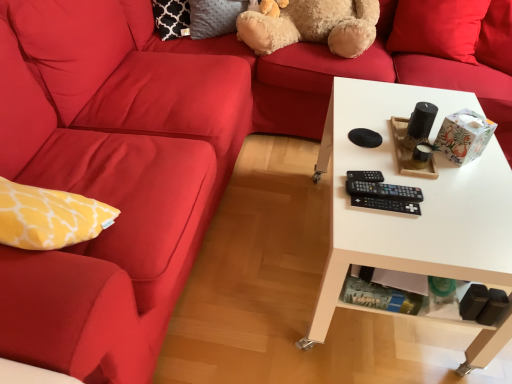
The width and height of the screenshot is (512, 384). I want to click on free spot in front of black plastic remote at center, the 1th control when ordered from front to back, so click(393, 235).